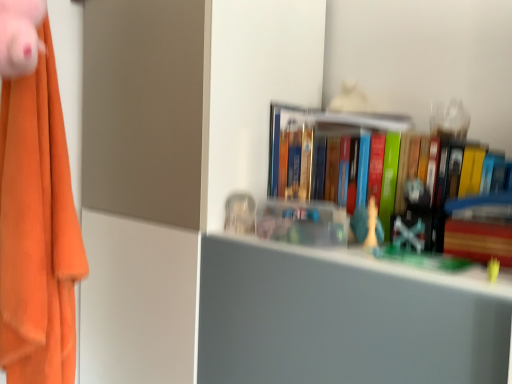
Question: Choose the correct answer: Is orange fabric at left inside clear plastic container at center, the 2th toy from the top, or outside it?

Choices:
 (A) outside
 (B) inside

Answer: (A)

Question: In terms of height, does orange fabric at left look taller or shorter compared to clear plastic container at center, marked as the 3th toy in a front-to-back arrangement?

Choices:
 (A) tall
 (B) short

Answer: (A)

Question: Based on their relative distances, which object is nearer to the pink plush toy at upper left, acting as the 1th toy starting from the top?

Choices:
 (A) clear plastic container at center, the 2th toy from the top
 (B) hardcover books at upper right
 (C) white plastic chess piece at center, which is the first toy from right to left
 (D) orange fabric at left
 (E) wooden paperback book at right

Answer: (A)

Question: Which is nearer to the orange fabric at left?

Choices:
 (A) clear plastic container at center, marked as the 3th toy in a front-to-back arrangement
 (B) wooden paperback book at right
 (C) white plastic chess piece at center, which is the third toy in left-to-right order
 (D) hardcover books at upper right
 (E) pink plush toy at upper left, marked as the 3th toy in a back-to-front arrangement

Answer: (A)